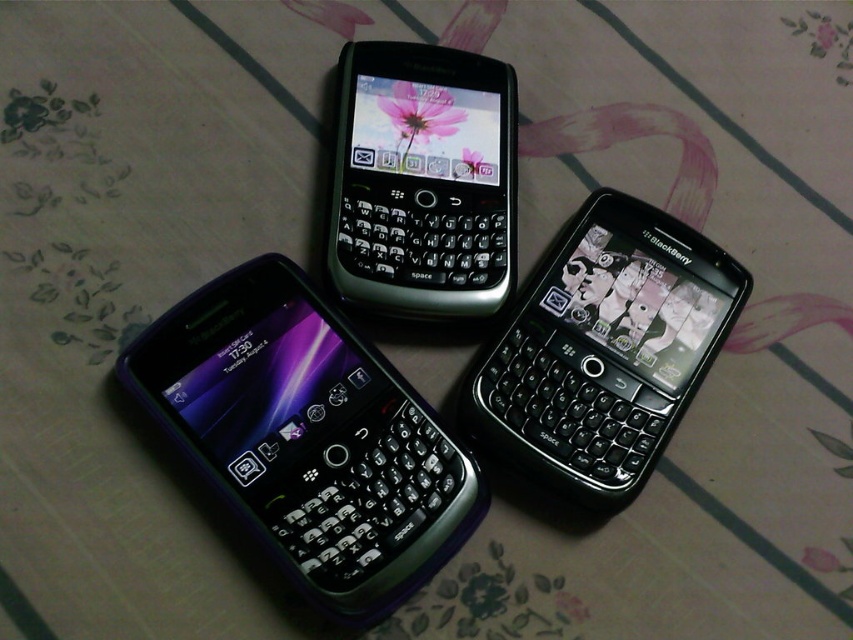
What do you see at coordinates (306, 436) in the screenshot? I see `purple rubberized phone at center-left` at bounding box center [306, 436].

Is purple rubberized phone at center-left above sleek black keyboard phone at center?

No.

Between point (318, 522) and point (431, 134), which one is positioned behind?

Positioned behind is point (431, 134).

The image size is (853, 640). Identify the location of purple rubberized phone at center-left. (306, 436).

Can you confirm if purple rubberized phone at center-left is thinner than black glossy phone at center right?

In fact, purple rubberized phone at center-left might be wider than black glossy phone at center right.

Does purple rubberized phone at center-left appear under black glossy phone at center right?

Yes, purple rubberized phone at center-left is below black glossy phone at center right.

The width and height of the screenshot is (853, 640). Find the location of `purple rubberized phone at center-left`. purple rubberized phone at center-left is located at coordinates (306, 436).

Does black glossy phone at center right lie behind sleek black keyboard phone at center?

No.

Is the position of black glossy phone at center right less distant than that of sleek black keyboard phone at center?

Yes, it is in front of sleek black keyboard phone at center.

Between point (602, 390) and point (354, 188), which one is positioned behind?

Point (354, 188)

Locate an element on the screen. The image size is (853, 640). black glossy phone at center right is located at coordinates (604, 349).